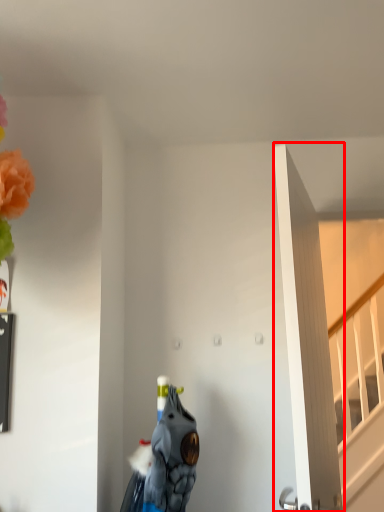
Question: From the image, what is the correct spatial relationship of door (annotated by the red box) in relation to animal?

Choices:
 (A) left
 (B) right

Answer: (B)